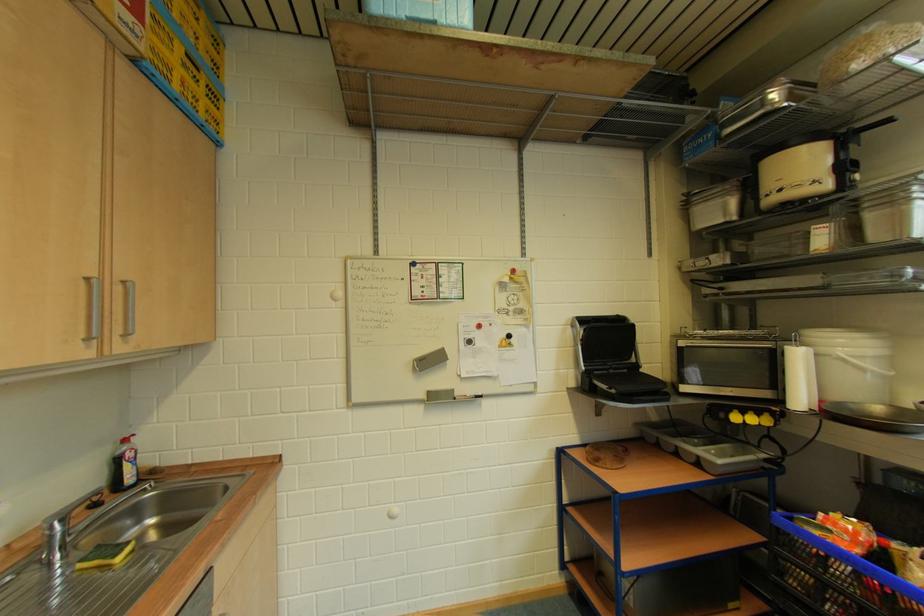
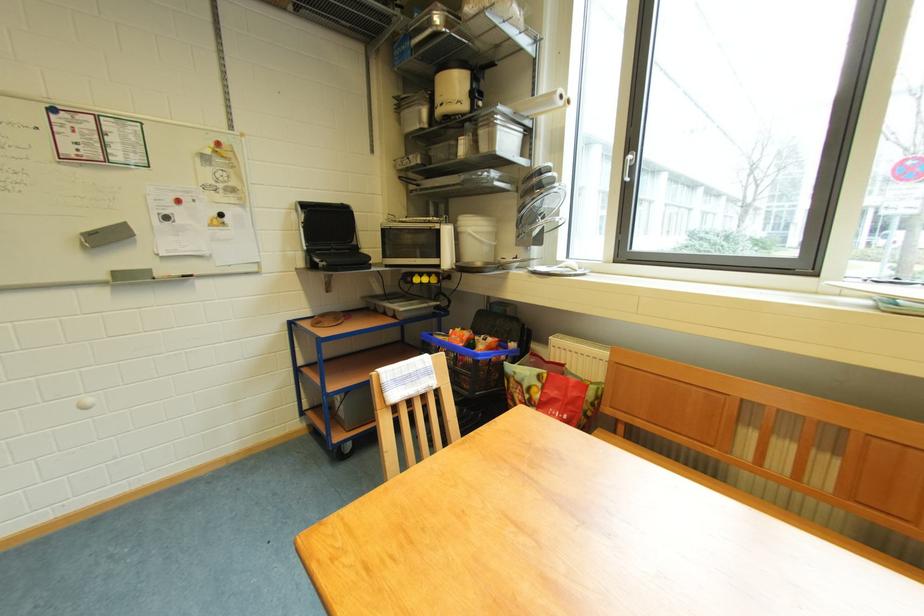
Find the pixel in the second image that matches point (687, 347) in the first image.

(390, 230)